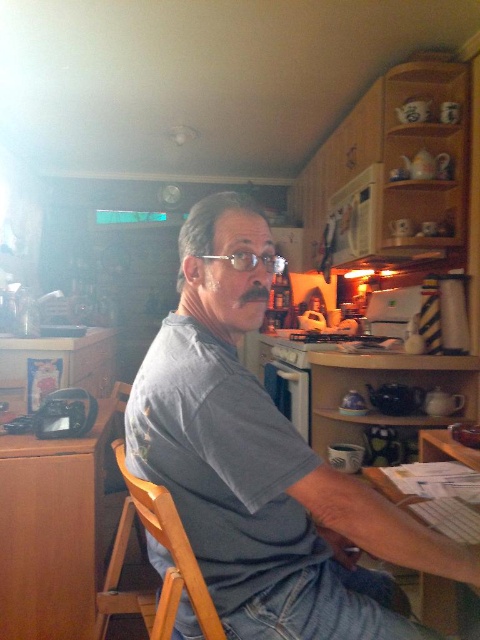
Looking at this image, you are standing in the kitchen and want to place a plate on the brown wood table at lower left. Based on its position, where should you walk to in order to reach the table?

The brown wood table at lower left is located at point (52, 531), so you should walk towards the lower left area of the kitchen to reach the table.

You are a guest in this kitchen and want to sit down in the wooden chair at center. However, you notice the gray cotton shirt at center is currently on the seat. Can you sit there without moving the shirt?

The gray cotton shirt at center is to the right of wooden chair at center, which means it is placed on the seat. Therefore, you cannot sit there without moving the shirt.